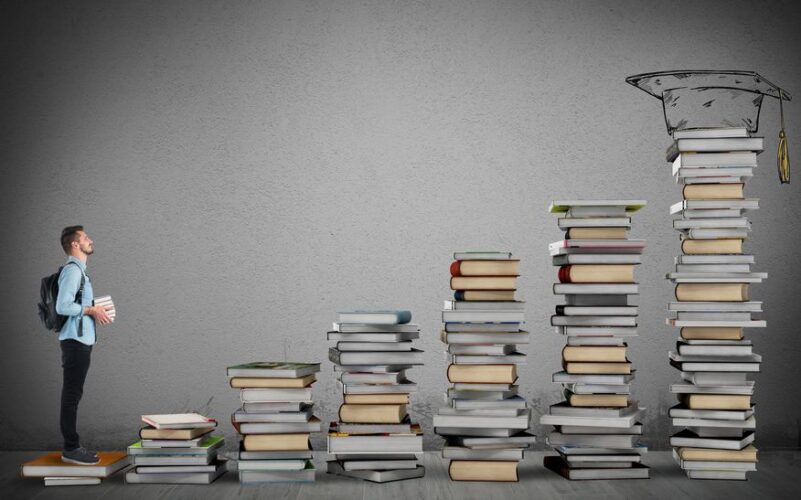
Locate an element on the screen. The height and width of the screenshot is (500, 801). books in 1st stack from the left is located at coordinates (63, 471), (70, 480), (26, 466), (123, 451).